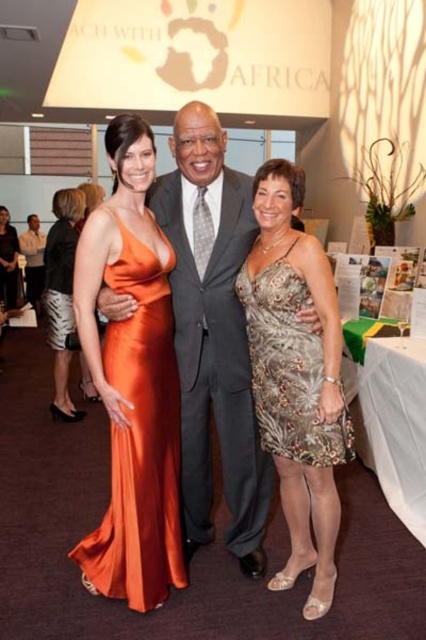
In the image of the formal event, there are two dresses present. The silver sequined dress at center and the orange satin dress at left. Which dress is positioned to the right of the other?

The silver sequined dress at center is positioned to the right of the orange satin dress at left.

What is the color of the dress at the point specified by the coordinates (288,369)?

The point at coordinates (288,369) is on the silver sequined dress at center, so the color is silver.